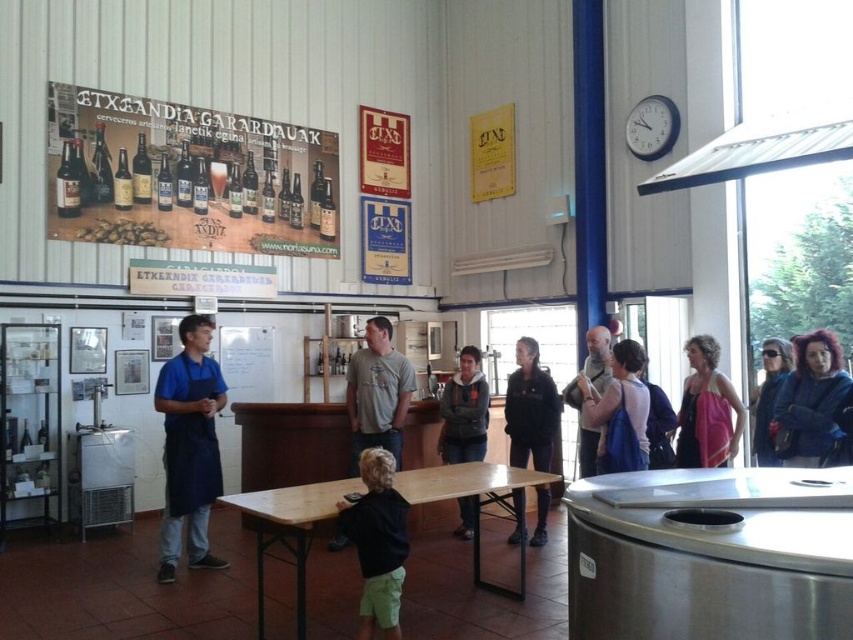
You are a tour guide in the TXKANDIA BREWERY. You notice a white plastic clock at upper right and a dark blue sweater at center. Which object is shorter in height?

The white plastic clock at upper right is shorter than the dark blue sweater at center.

You are standing in the brewery and want to place a 3.5 meter long banner on the floor between you and the light brown wooden table at center. Is there enough space?

The distance between you and the light brown wooden table at center is 3.37 meters, which is shorter than the 3.5 meter banner. Therefore, the banner will not fit.

You are a visitor at the TXKANDIA BREWERY. You notice two items in the scene. One is the matte paper poster at upper left and the other is the black matte shirt at lower center. From your perspective, which item is closer to you?

The black matte shirt at lower center is behind the matte paper poster at upper left, so the matte paper poster at upper left is closer to you.